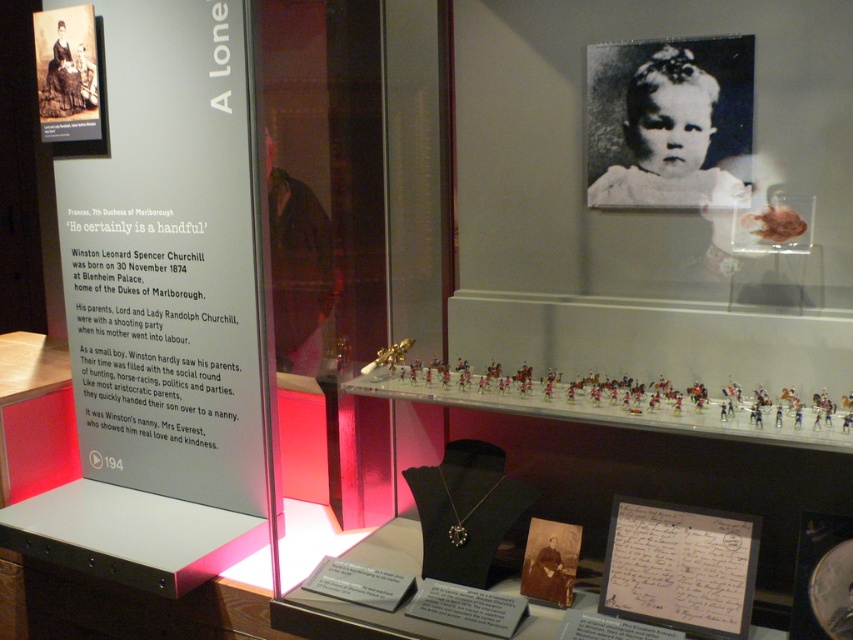
Question: Which point is farther to the camera?

Choices:
 (A) (173, 97)
 (B) (77, 54)

Answer: (B)

Question: Considering the relative positions of matte gray sign at left and black paper at upper center in the image provided, where is matte gray sign at left located with respect to black paper at upper center?

Choices:
 (A) below
 (B) above

Answer: (A)

Question: Which point is farther from the camera taking this photo?

Choices:
 (A) (653, 189)
 (B) (157, 464)
 (C) (57, 115)

Answer: (B)

Question: Does black paper at upper center lie behind matte black portrait at upper left?

Choices:
 (A) no
 (B) yes

Answer: (A)

Question: Is matte gray sign at left above matte black portrait at upper left?

Choices:
 (A) yes
 (B) no

Answer: (B)

Question: Which object is farther from the camera taking this photo?

Choices:
 (A) matte black portrait at upper left
 (B) matte gray sign at left

Answer: (A)